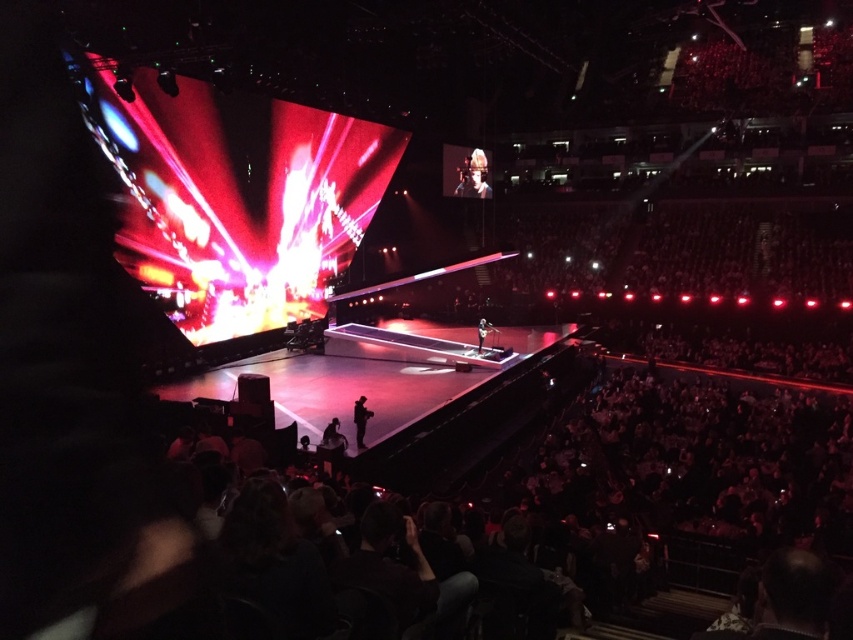
You are standing at the point marked as point (485, 168) in the arena. The stage is 150 feet long. Can you see the entire length of the stage from your current position?

The point marked as point (485, 168) is 159.43 feet away from the viewer. Since the stage is 150 feet long, you can see the entire length of the stage from your current position because you are farther away than the stage length.

You are a photographer at the concert and need to capture a clear shot of both the dark gray fabric jacket at center and the smooth black suit at center. Since the stage is crowded, you want to know which one is closer to the camera. Can you determine this based on their sizes in the image?

The dark gray fabric jacket at center is smaller than the smooth black suit at center, so it is farther away from the camera compared to the smooth black suit at center.

You are a stagehand at the concert venue and need to move a 12 meter long extension cord from the smooth skin face at upper center to the smooth black suit at center. Will the cord be long enough to reach between them?

The smooth skin face at upper center and smooth black suit at center are 12.69 meters apart from each other. The extension cord is only 12 meters long, so it will be 0.69 meters short and not long enough to reach between them.